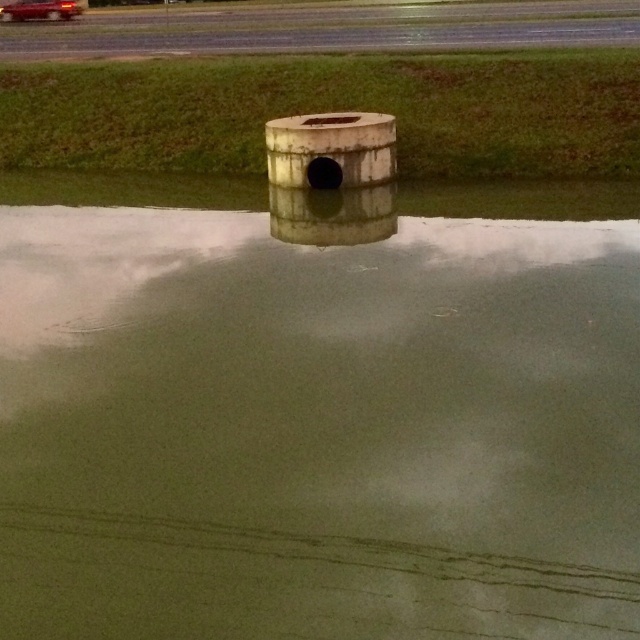
In the scene shown: You are a photographer trying to capture the metallic red car at upper left and the concrete runway at upper center in the same frame. Based on their positions, which object should you place closer to the left edge of your camera viewfinder?

The metallic red car at upper left should be placed closer to the left edge of your camera viewfinder because the concrete runway at upper center is positioned on the right side of it.

Consider the image. You are a drone operator trying to land your drone on the concrete runway at upper center. There is a matte concrete pipe at center nearby. Which direction should you adjust your landing path to avoid the pipe?

The concrete runway at upper center is to the left of the matte concrete pipe at center, so you should adjust your landing path to the right to avoid the pipe.

You are a pilot preparing to land a small aircraft on the runway. The metallic red car at upper left is parked near the concrete runway at upper center. Is the runway accessible for landing?

The concrete runway at upper center is in front of the metallic red car at upper left, meaning the runway is not blocked by the car and should be accessible for landing.